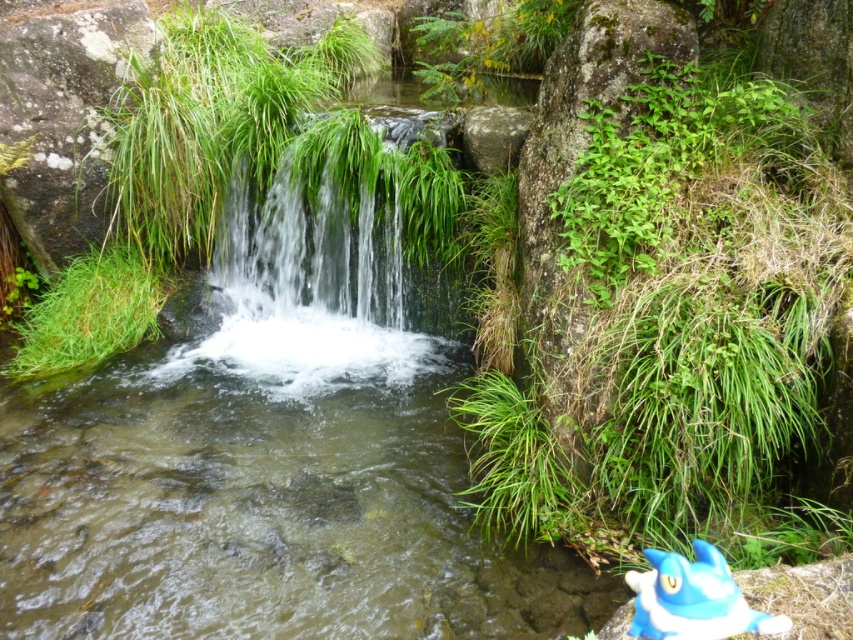
You are standing at the edge of the pool and see the clear water cascade at center and the blue plush toy at lower right. Which object is closer to your right side?

The blue plush toy at lower right is closer to your right side because it is positioned to the right of the clear water cascade at center.